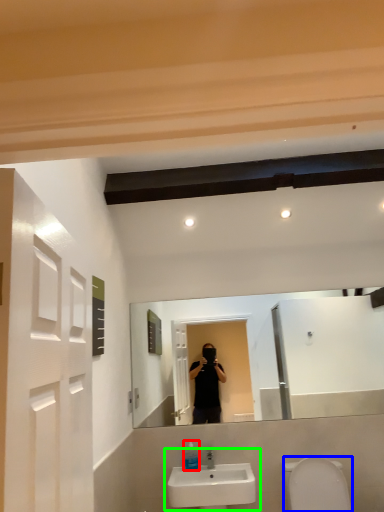
Question: Based on their relative distances, which object is farther from soap dispenser (highlighted by a red box)? Choose from toilet bowl (highlighted by a blue box) and sink (highlighted by a green box).

Choices:
 (A) toilet bowl
 (B) sink

Answer: (A)